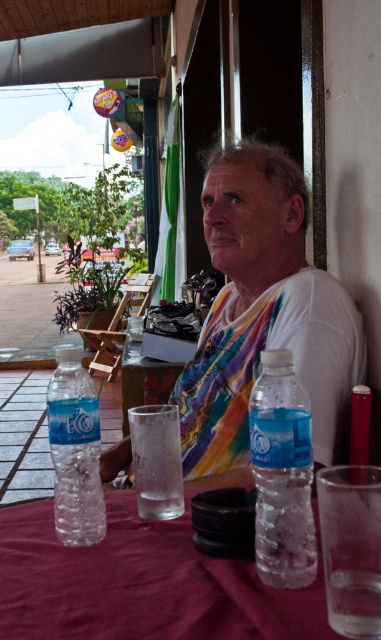
You are a photographer trying to capture the exact position of the white matte shirt at center in the image. According to the coordinates provided, where is the white matte shirt located in the image?

The white matte shirt at center is located at point coordinates of 0.492 on the x axis and 0.690 on the y axis.

You are a waiter at the outdoor cafe and need to place a new order of drinks on the table. The new drinks are in a container that is 5 cm in diameter. Will the container fit in the space between the clear plastic bottle at lower center and the transparent glass at table right?

The clear plastic bottle at lower center is thinner than the transparent glass at table right. Since the container is 5 cm in diameter, it depends on the available space between them. However, without knowing the exact distance between the two objects, we cannot definitively determine if it will fit. Please measure the space before placing the container.